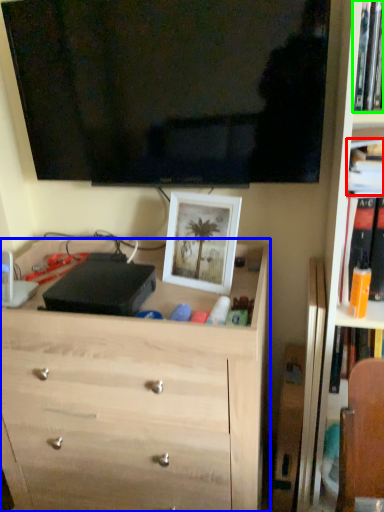
Question: Estimate the real-world distances between objects in this image. Which object is farther from book (highlighted by a red box), chest of drawers (highlighted by a blue box) or book (highlighted by a green box)?

Choices:
 (A) chest of drawers
 (B) book

Answer: (A)